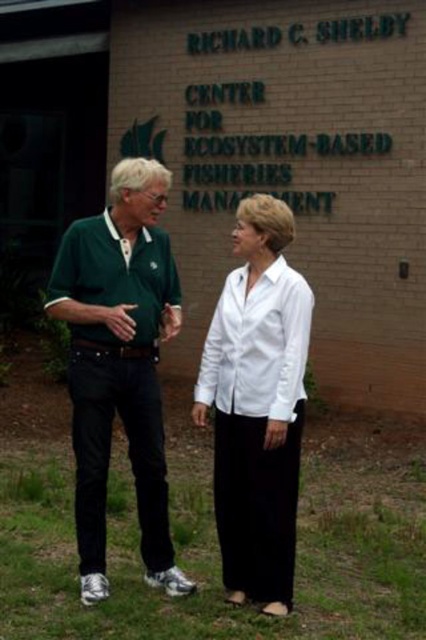
Is point (104, 506) less distant than point (236, 451)?

No, it is behind (236, 451).

Can you confirm if green jersey at center is bigger than white smooth blouse at center?

Yes.

Describe the element at coordinates (120, 364) in the screenshot. I see `green jersey at center` at that location.

Find the location of `green jersey at center`. green jersey at center is located at coordinates (120, 364).

Which is more to the left, green jersey at center or white smooth shirt at center?

Positioned to the left is green jersey at center.

What do you see at coordinates (120, 364) in the screenshot?
I see `green jersey at center` at bounding box center [120, 364].

You are a GUI agent. You are given a task and a screenshot of the screen. Output one action in this format:
    pyautogui.click(x=<x>, y=<y>)
    Task: Click on the green jersey at center
    The image size is (426, 640).
    Given the screenshot: What is the action you would take?
    pyautogui.click(x=120, y=364)

Does white smooth blouse at center appear over white smooth shirt at center?

No, white smooth blouse at center is not above white smooth shirt at center.

Is white smooth blouse at center taller than white smooth shirt at center?

Yes.

At what (x,y) coordinates should I click in order to perform the action: click on white smooth blouse at center. Please return your answer as a coordinate pair (x, y). The height and width of the screenshot is (640, 426). Looking at the image, I should click on (256, 404).

At what (x,y) coordinates should I click in order to perform the action: click on white smooth blouse at center. Please return your answer as a coordinate pair (x, y). The image size is (426, 640). Looking at the image, I should click on (256, 404).